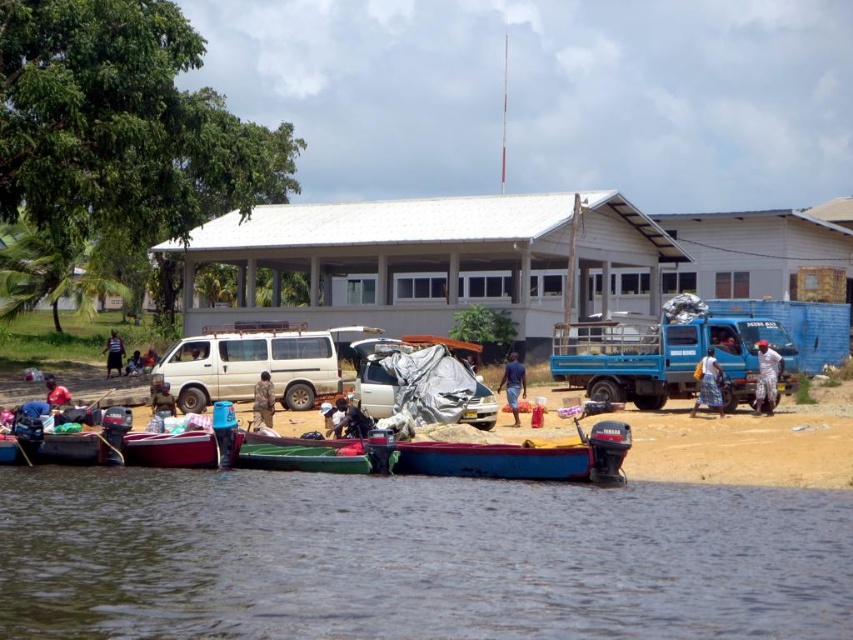
What do you see at coordinates (183, 449) in the screenshot? This screenshot has width=853, height=640. I see `wooden canoe at center` at bounding box center [183, 449].

Is wooden canoe at center shorter than red fabric bag at lower left?

In fact, wooden canoe at center may be taller than red fabric bag at lower left.

Where is `wooden canoe at center`? The height and width of the screenshot is (640, 853). wooden canoe at center is located at coordinates [x=183, y=449].

Is white matte van at center to the right of dark blue fabric at lower left from the viewer's perspective?

Indeed, white matte van at center is positioned on the right side of dark blue fabric at lower left.

Can you confirm if white matte van at center is taller than dark blue fabric at lower left?

Indeed, white matte van at center has a greater height compared to dark blue fabric at lower left.

This screenshot has height=640, width=853. What are the coordinates of `white matte van at center` in the screenshot? It's located at (250, 368).

Where is `white matte van at center`? white matte van at center is located at coordinates (250, 368).

Is dark blue fabric pants at right positioned at the back of camouflage fabric person at center?

Yes, dark blue fabric pants at right is further from the viewer.

Identify the location of dark blue fabric pants at right. This screenshot has height=640, width=853. (766, 378).

Image resolution: width=853 pixels, height=640 pixels. What do you see at coordinates (766, 378) in the screenshot? I see `dark blue fabric pants at right` at bounding box center [766, 378].

Identify the location of dark blue fabric pants at right. (766, 378).